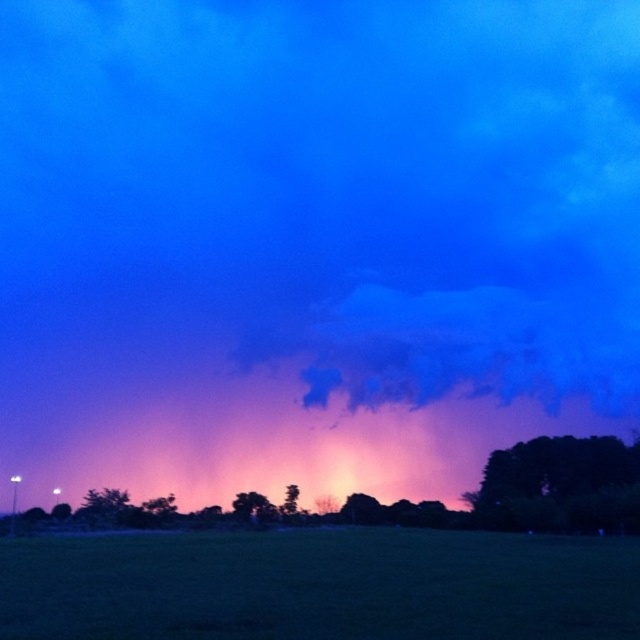
Can you confirm if green grass at lower center is bigger than dark green leafy tree at lower right?

Yes.

Which of these two, green grass at lower center or dark green leafy tree at lower right, stands taller?

green grass at lower center is taller.

Between point (588, 547) and point (628, 464), which one is positioned in front?

Point (588, 547) is more forward.

Locate an element on the screen. green grass at lower center is located at coordinates (320, 586).

Between green matte tree at center and green leafy tree at center, which one is positioned lower?

green matte tree at center is lower down.

Can you confirm if green matte tree at center is positioned above green leafy tree at center?

No, green matte tree at center is not above green leafy tree at center.

Which is in front, point (253, 515) or point (280, 506)?

Point (253, 515) is in front.

Identify the location of green matte tree at center. The width and height of the screenshot is (640, 640). (252, 508).

Does green grass at lower center have a smaller size compared to green matte tree at center?

No, green grass at lower center is not smaller than green matte tree at center.

Between point (90, 545) and point (272, 509), which one is positioned behind?

The point (272, 509) is behind.

Locate an element on the screen. green grass at lower center is located at coordinates (320, 586).